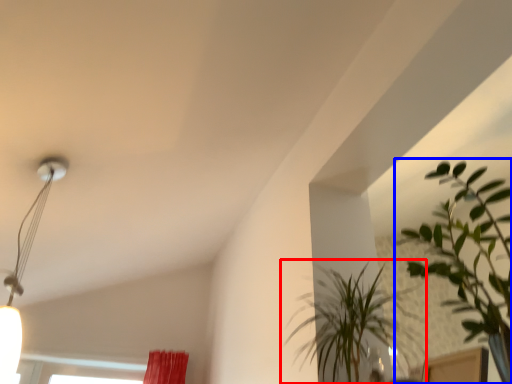
Question: Which object is further to the camera taking this photo, houseplant (highlighted by a red box) or houseplant (highlighted by a blue box)?

Choices:
 (A) houseplant
 (B) houseplant

Answer: (A)